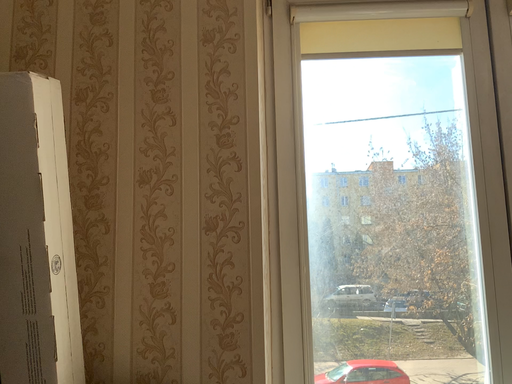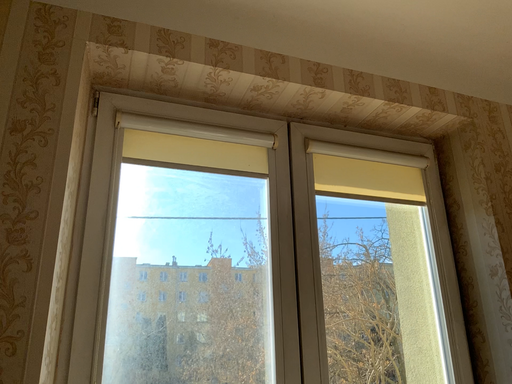
Question: How did the camera likely rotate when shooting the video?

Choices:
 (A) rotated left
 (B) rotated right

Answer: (B)